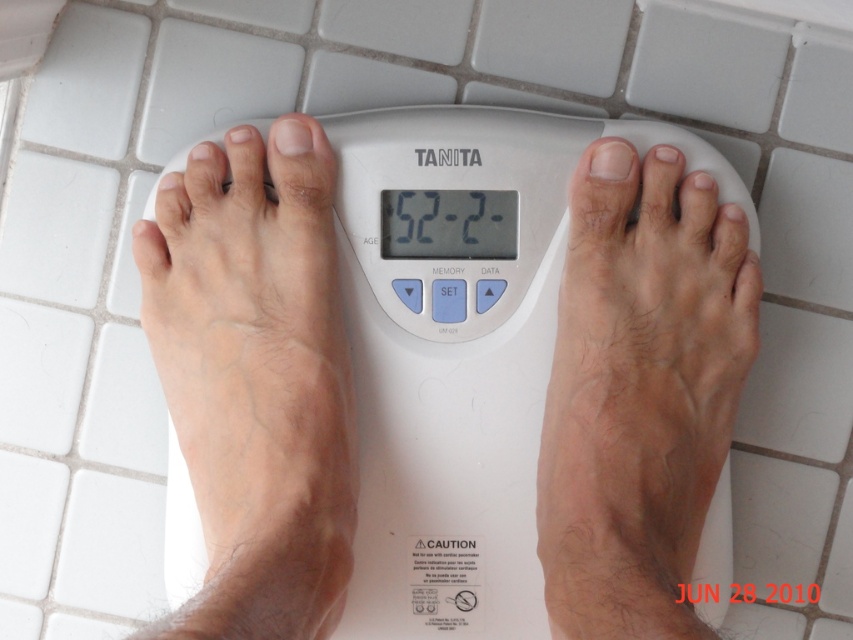
Question: Is white plastic scale at center below pale skin at center?

Choices:
 (A) yes
 (B) no

Answer: (A)

Question: Is white plastic scale at center thinner than pale skin at center?

Choices:
 (A) no
 (B) yes

Answer: (A)

Question: Which object is farther from the camera taking this photo?

Choices:
 (A) black plastic thermometer at center
 (B) pale skin at center

Answer: (A)

Question: Among these points, which one is nearest to the camera?

Choices:
 (A) (437, 220)
 (B) (334, 580)

Answer: (B)

Question: Can you confirm if pale skin at center is positioned above light skin textured foot at center?

Choices:
 (A) no
 (B) yes

Answer: (B)

Question: Which point appears farthest from the camera in this image?

Choices:
 (A) (334, 380)
 (B) (740, 340)
 (C) (404, 408)
 (D) (431, 189)

Answer: (D)